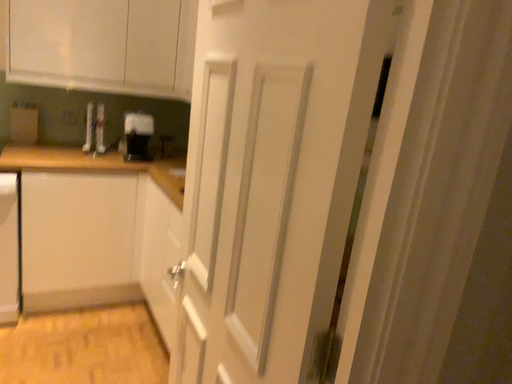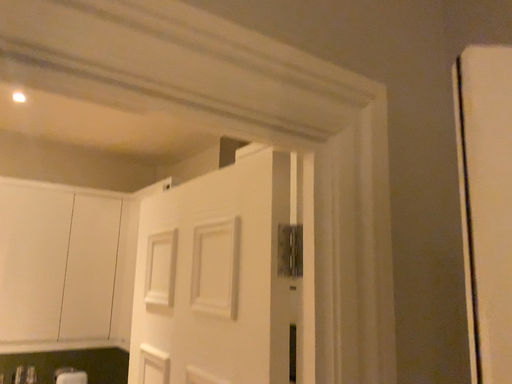
Question: Which way did the camera rotate in the video?

Choices:
 (A) rotated left
 (B) rotated right

Answer: (B)